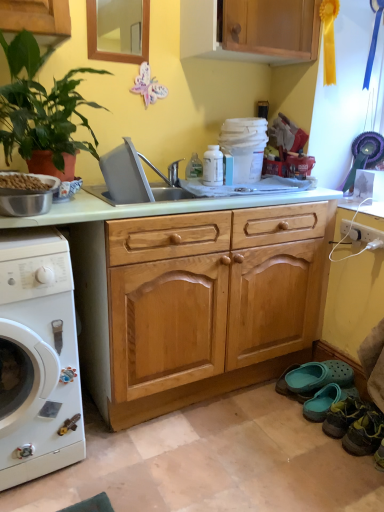
Question: Is leather shoe at lower right, the 4th shoe viewed from the back, at the back of leather shoe at lower right, placed as the third shoe when sorted from back to front?

Choices:
 (A) no
 (B) yes

Answer: (A)

Question: Is leather shoe at lower right, placed as the third shoe when sorted from back to front, far from leather shoe at lower right, placed as the first shoe when sorted from front to back?

Choices:
 (A) no
 (B) yes

Answer: (A)

Question: Does leather shoe at lower right, which is the second shoe from front to back, come behind leather shoe at lower right, the 4th shoe viewed from the back?

Choices:
 (A) no
 (B) yes

Answer: (B)

Question: Does leather shoe at lower right, placed as the third shoe when sorted from back to front, have a larger size compared to leather shoe at lower right, placed as the first shoe when sorted from front to back?

Choices:
 (A) yes
 (B) no

Answer: (A)

Question: Is leather shoe at lower right, which is the second shoe from front to back, facing towards leather shoe at lower right, the 4th shoe viewed from the back?

Choices:
 (A) yes
 (B) no

Answer: (B)

Question: Considering their positions, is wooden cabinet at upper center located in front of or behind leather shoe at lower right, placed as the third shoe when sorted from back to front?

Choices:
 (A) front
 (B) behind

Answer: (A)

Question: Based on their sizes in the image, would you say wooden cabinet at upper center is bigger or smaller than leather shoe at lower right, placed as the third shoe when sorted from back to front?

Choices:
 (A) small
 (B) big

Answer: (B)

Question: From the image's perspective, relative to leather shoe at lower right, which is the second shoe from front to back, is wooden cabinet at upper center above or below?

Choices:
 (A) below
 (B) above

Answer: (B)

Question: Based on their positions, is wooden cabinet at upper center located to the left or right of leather shoe at lower right, which is the second shoe from front to back?

Choices:
 (A) right
 (B) left

Answer: (B)

Question: Relative to teal rubber clog at lower right, which is the 4th shoe in front-to-back order, is leather shoe at lower right, which is the second shoe from front to back, in front or behind?

Choices:
 (A) front
 (B) behind

Answer: (A)

Question: Considering the positions of point (327, 423) and point (347, 367), is point (327, 423) closer or farther from the camera than point (347, 367)?

Choices:
 (A) farther
 (B) closer

Answer: (B)

Question: In terms of height, does leather shoe at lower right, which is the second shoe from front to back, look taller or shorter compared to teal rubber clog at lower right, the 1th shoe positioned from the back?

Choices:
 (A) tall
 (B) short

Answer: (A)

Question: Looking at the image, does leather shoe at lower right, placed as the third shoe when sorted from back to front, seem bigger or smaller compared to teal rubber clog at lower right, the 1th shoe positioned from the back?

Choices:
 (A) small
 (B) big

Answer: (B)

Question: Considering the positions of point (334, 430) and point (6, 108), is point (334, 430) closer or farther from the camera than point (6, 108)?

Choices:
 (A) closer
 (B) farther

Answer: (B)

Question: Would you say leather shoe at lower right, which is the second shoe from front to back, is to the left or to the right of green leafy plant at left in the picture?

Choices:
 (A) right
 (B) left

Answer: (A)